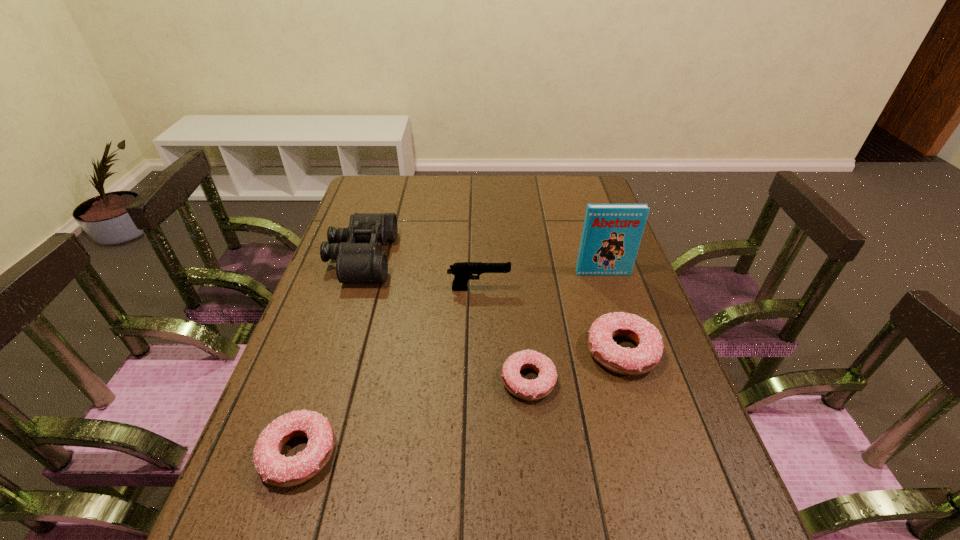
Image resolution: width=960 pixels, height=540 pixels. In order to click on vacant area that lies between the shortest object and the pistol in this screenshot , I will do tap(504, 335).

This screenshot has width=960, height=540. What are the coordinates of `empty location between the shortest doughnut and the binoculars` in the screenshot? It's located at (444, 320).

Identify the location of free space between the rightmost doughnut and the nearest doughnut. (461, 403).

Identify the location of the fifth closest object relative to the tallest object. This screenshot has width=960, height=540. [275, 469].

At what (x,y) coordinates should I click in order to perform the action: click on object identified as the closest to the book. Please return your answer as a coordinate pair (x, y). Looking at the image, I should click on (645, 357).

Locate an element on the screen. doughnut that stands as the closest to the rightmost doughnut is located at coordinates (531, 390).

Image resolution: width=960 pixels, height=540 pixels. I want to click on the second closest doughnut relative to the rightmost doughnut, so click(275, 469).

I want to click on vacant space that satisfies the following two spatial constraints: 1. at the eyepieces of the binoculars; 2. on the left side of the nearest doughnut, so click(x=298, y=454).

I want to click on vacant point that satisfies the following two spatial constraints: 1. on the back side of the nearest object; 2. at the eyepieces of the binoculars, so click(x=362, y=258).

The width and height of the screenshot is (960, 540). Find the location of `free space that satisfies the following two spatial constraints: 1. on the back side of the shortest object; 2. on the right side of the nearest doughnut`. free space that satisfies the following two spatial constraints: 1. on the back side of the shortest object; 2. on the right side of the nearest doughnut is located at coordinates (323, 381).